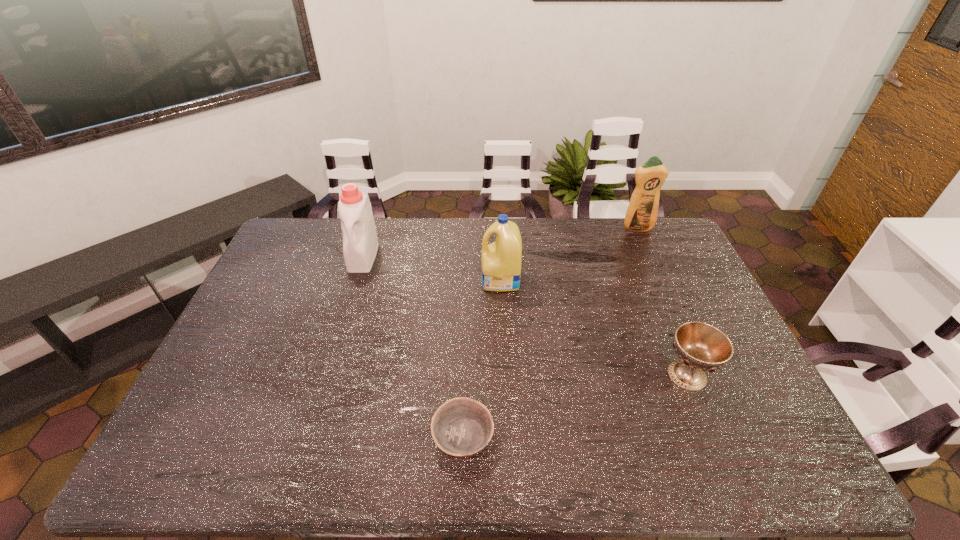
This screenshot has height=540, width=960. In order to click on the farthest object in this screenshot , I will do `click(641, 215)`.

Image resolution: width=960 pixels, height=540 pixels. I want to click on the farthest detergent, so click(641, 215).

The height and width of the screenshot is (540, 960). I want to click on the leftmost detergent, so click(360, 243).

Where is `the second detergent from right to left`? the second detergent from right to left is located at coordinates (501, 260).

You are a GUI agent. You are given a task and a screenshot of the screen. Output one action in this format:
    pyautogui.click(x=<x>, y=<y>)
    Task: Click on the fourth farthest object
    Image resolution: width=960 pixels, height=540 pixels.
    Given the screenshot: What is the action you would take?
    click(x=701, y=347)

Locate an element on the screen. The height and width of the screenshot is (540, 960). the second shortest object is located at coordinates (701, 347).

In order to click on bowl in this screenshot , I will do `click(461, 427)`.

Where is `the shortest object`? This screenshot has width=960, height=540. the shortest object is located at coordinates (461, 427).

Locate an element on the screen. The height and width of the screenshot is (540, 960). free space located 0.160m on the label of the farthest detergent is located at coordinates (652, 260).

The image size is (960, 540). Identify the location of free space located on the handle side of the leftmost detergent. (343, 322).